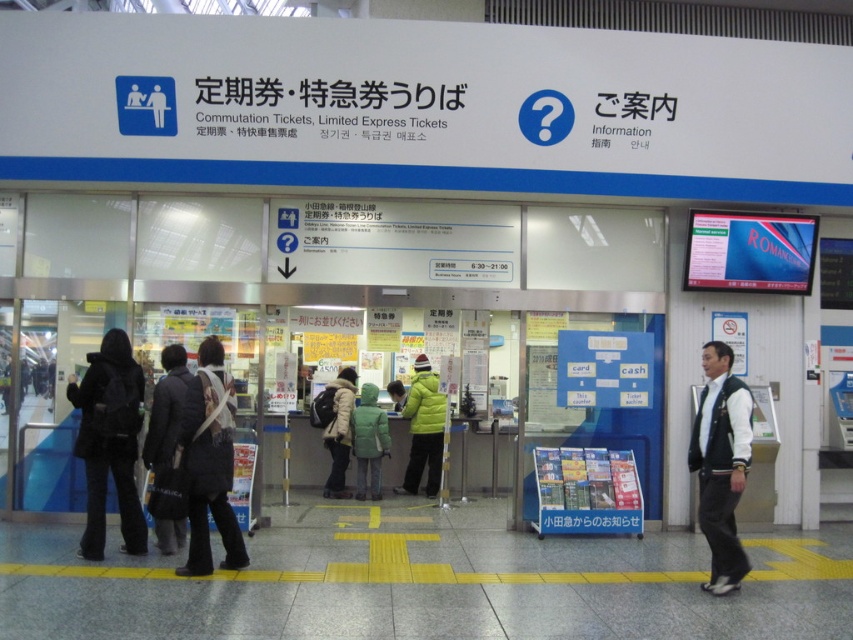
Question: Which point is closer to the camera?

Choices:
 (A) dark gray fabric coat at lower left
 (B) matte yellow jacket at center
 (C) green matte jacket at center
 (D) white fuzzy coat at center

Answer: (A)

Question: Estimate the real-world distances between objects in this image. Which object is farther from the dark gray coat at center?

Choices:
 (A) matte yellow jacket at center
 (B) green matte jacket at center

Answer: (A)

Question: Can you confirm if white matte vest at right is positioned above matte yellow jacket at center?

Choices:
 (A) no
 (B) yes

Answer: (B)

Question: Does dark gray coat at center appear under white fuzzy coat at center?

Choices:
 (A) no
 (B) yes

Answer: (A)

Question: Does dark gray coat at center appear on the left side of white fuzzy coat at center?

Choices:
 (A) no
 (B) yes

Answer: (B)

Question: Among these points, which one is farthest from the camera?

Choices:
 (A) (136, 522)
 (B) (434, 456)
 (C) (376, 417)

Answer: (B)